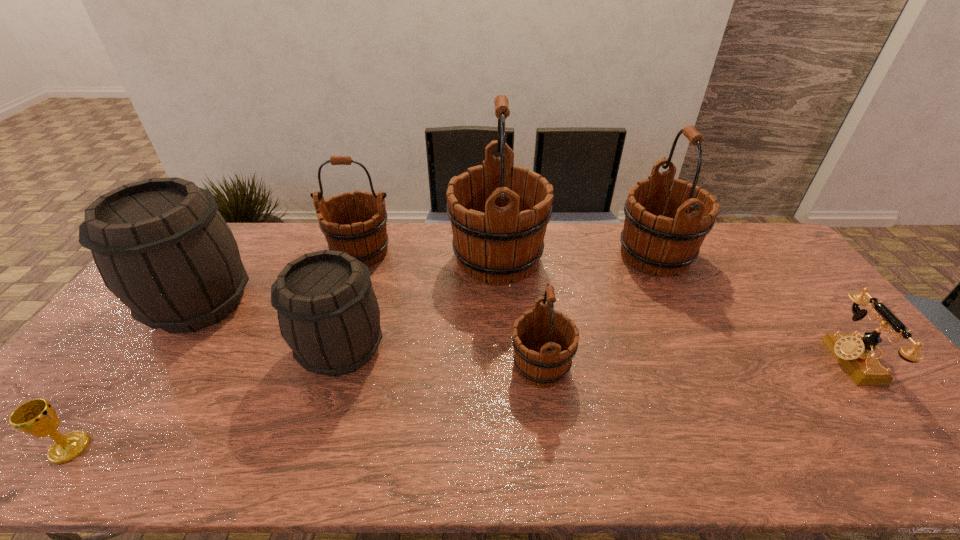
Where is `the tallest wine bucket`? The image size is (960, 540). the tallest wine bucket is located at coordinates (499, 212).

Image resolution: width=960 pixels, height=540 pixels. I want to click on the tallest object, so click(x=499, y=212).

The width and height of the screenshot is (960, 540). I want to click on the second tallest wine bucket, so click(x=655, y=239).

In order to click on the seventh shortest object in this screenshot , I will do `click(655, 239)`.

Locate an element on the screen. the second smallest wood wine bucket is located at coordinates (355, 223).

Identify the location of the left brown wine bucket. The width and height of the screenshot is (960, 540). (161, 246).

At what (x,y) coordinates should I click in order to perform the action: click on the leftmost wine bucket. Please return your answer as a coordinate pair (x, y). This screenshot has width=960, height=540. Looking at the image, I should click on (161, 246).

Locate an element on the screen. the right brown wine bucket is located at coordinates (328, 314).

The image size is (960, 540). Identify the location of the smallest wood wine bucket. (545, 341).

Locate an element on the screen. the rightmost object is located at coordinates (856, 355).